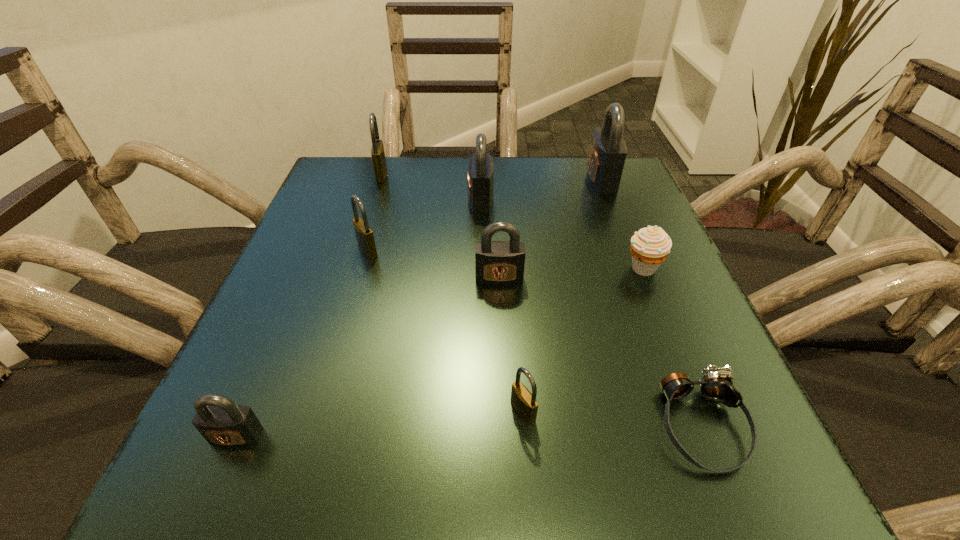
What are the coordinates of `vacant space located 0.170m on the front of the second biggest gray padlock near the keyhole` in the screenshot? It's located at click(x=391, y=199).

At what (x,y) coordinates should I click in order to perform the action: click on free space located 0.390m on the front of the farthest brass padlock. Please return your answer as a coordinate pair (x, y). Image resolution: width=960 pixels, height=540 pixels. Looking at the image, I should click on pos(340,306).

This screenshot has height=540, width=960. What are the coordinates of `vacant space located on the front of the third nearest padlock near the keyhole` in the screenshot? It's located at (504, 377).

Where is `free space located 0.120m on the back of the fourth farthest padlock`? The height and width of the screenshot is (540, 960). free space located 0.120m on the back of the fourth farthest padlock is located at coordinates (380, 207).

Where is `free region located 0.140m on the back of the muffin`? The height and width of the screenshot is (540, 960). free region located 0.140m on the back of the muffin is located at coordinates (621, 213).

At what (x,y) coordinates should I click in order to perform the action: click on free space located on the left of the nearest brass padlock. Please return your answer as a coordinate pair (x, y). This screenshot has height=540, width=960. Looking at the image, I should click on (275, 411).

Find the location of a particular element. This screenshot has height=540, width=960. vacant space located on the front of the leftmost gray padlock near the keyhole is located at coordinates (209, 498).

The image size is (960, 540). I want to click on padlock located in the near edge section of the desktop, so click(x=222, y=422).

Locate an element on the screen. goggles at the near edge is located at coordinates (715, 386).

The image size is (960, 540). What are the coordinates of `padlock located in the right edge section of the desktop` in the screenshot? It's located at (608, 152).